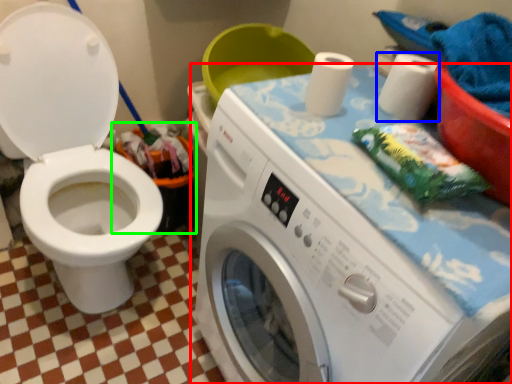
Question: Estimate the real-world distances between objects in this image. Which object is farther from washing machine (highlighted by a red box), toilet paper (highlighted by a blue box) or recycling bin (highlighted by a green box)?

Choices:
 (A) toilet paper
 (B) recycling bin

Answer: (B)